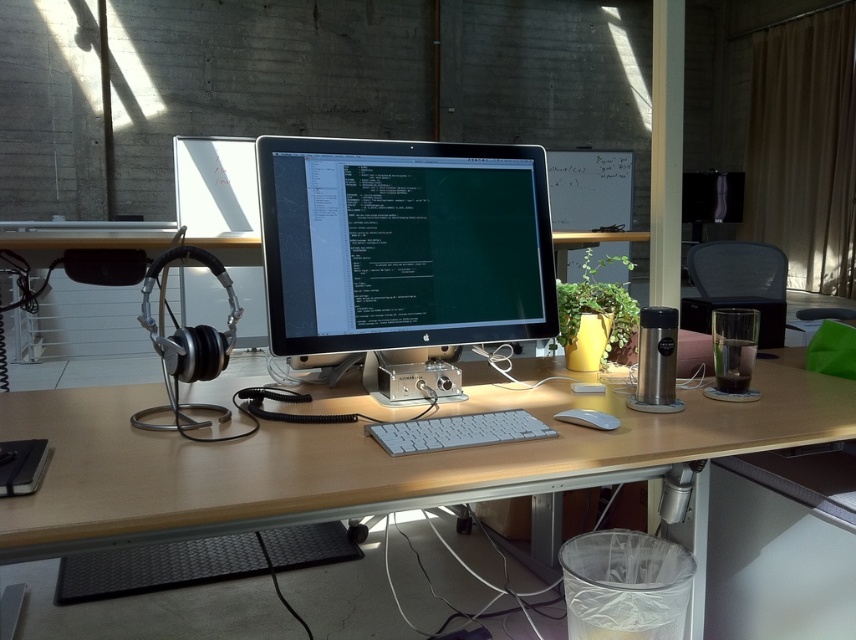
How distant is matte white desk at center from white plastic keyboard at center?

matte white desk at center is 9.32 inches from white plastic keyboard at center.

Looking at this image, can you confirm if matte white desk at center is wider than white plastic keyboard at center?

Correct, the width of matte white desk at center exceeds that of white plastic keyboard at center.

The image size is (856, 640). Describe the element at coordinates (367, 460) in the screenshot. I see `matte white desk at center` at that location.

Locate an element on the screen. matte white desk at center is located at coordinates (367, 460).

Does satin black monitor at center have a lesser height compared to white plastic keyboard at center?

No, satin black monitor at center is not shorter than white plastic keyboard at center.

Who is more distant from viewer, (x=324, y=268) or (x=467, y=417)?

The point (x=324, y=268) is behind.

Between point (545, 211) and point (415, 419), which one is positioned behind?

The point (545, 211) is more distant.

Locate an element on the screen. The height and width of the screenshot is (640, 856). satin black monitor at center is located at coordinates (403, 243).

Can you confirm if satin black monitor at center is smaller than white matte mouse at center?

No.

Is point (443, 193) positioned in front of point (598, 412)?

That is False.

Identify the location of satin black monitor at center. click(x=403, y=243).